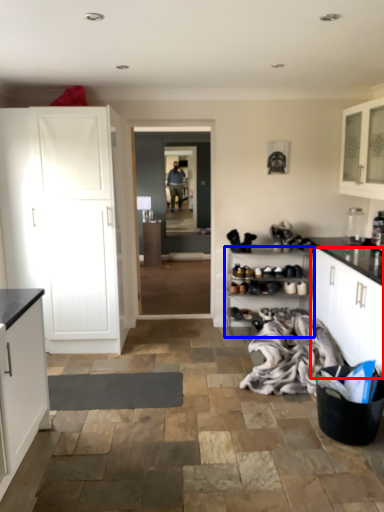
Question: Which object is closer to the camera taking this photo, cabinetry (highlighted by a red box) or shelf (highlighted by a blue box)?

Choices:
 (A) cabinetry
 (B) shelf

Answer: (A)